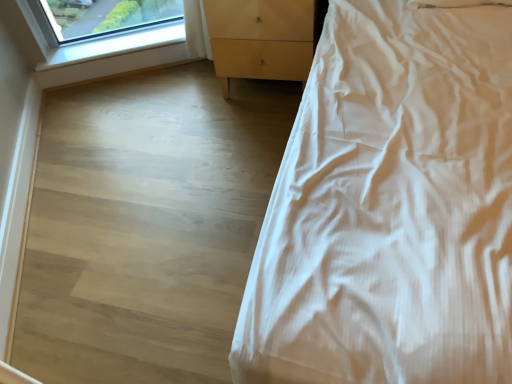
Question: Is white smooth bed at right positioned behind clear glass window at upper left?

Choices:
 (A) no
 (B) yes

Answer: (A)

Question: Can clear glass window at upper left be found inside white smooth bed at right?

Choices:
 (A) no
 (B) yes

Answer: (A)

Question: Can you confirm if white smooth bed at right is bigger than clear glass window at upper left?

Choices:
 (A) yes
 (B) no

Answer: (A)

Question: Considering the relative sizes of white smooth bed at right and clear glass window at upper left in the image provided, is white smooth bed at right smaller than clear glass window at upper left?

Choices:
 (A) no
 (B) yes

Answer: (A)

Question: From a real-world perspective, is white smooth bed at right on top of clear glass window at upper left?

Choices:
 (A) yes
 (B) no

Answer: (A)

Question: Is white smooth bed at right taller than clear glass window at upper left?

Choices:
 (A) yes
 (B) no

Answer: (A)

Question: Could you tell me if light wood/texture chest of drawers at center is turned towards light wood at upper left?

Choices:
 (A) yes
 (B) no

Answer: (B)

Question: Is light wood/texture chest of drawers at center closer to the viewer compared to light wood at upper left?

Choices:
 (A) no
 (B) yes

Answer: (B)

Question: Does light wood/texture chest of drawers at center appear on the left side of light wood at upper left?

Choices:
 (A) yes
 (B) no

Answer: (B)

Question: From the image's perspective, would you say light wood/texture chest of drawers at center is positioned over light wood at upper left?

Choices:
 (A) yes
 (B) no

Answer: (A)

Question: Does light wood/texture chest of drawers at center appear on the right side of light wood at upper left?

Choices:
 (A) yes
 (B) no

Answer: (A)

Question: Considering the relative sizes of light wood/texture chest of drawers at center and light wood at upper left in the image provided, is light wood/texture chest of drawers at center smaller than light wood at upper left?

Choices:
 (A) yes
 (B) no

Answer: (B)

Question: Is the depth of light wood/texture chest of drawers at center less than that of white smooth bed at right?

Choices:
 (A) yes
 (B) no

Answer: (B)